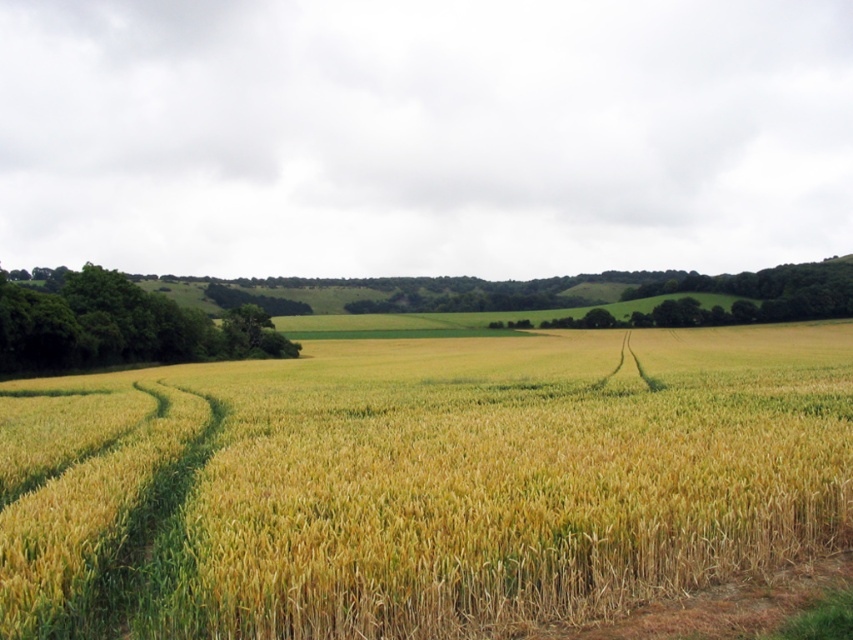
Which is more to the left, yellow grainy wheat field at center or green leafy trees at left?

Positioned to the left is green leafy trees at left.

Is point (686, 464) farther from viewer compared to point (47, 348)?

No.

Image resolution: width=853 pixels, height=640 pixels. Find the location of `yellow grainy wheat field at center`. yellow grainy wheat field at center is located at coordinates (422, 483).

Locate an element on the screen. This screenshot has height=640, width=853. yellow grainy wheat field at center is located at coordinates (422, 483).